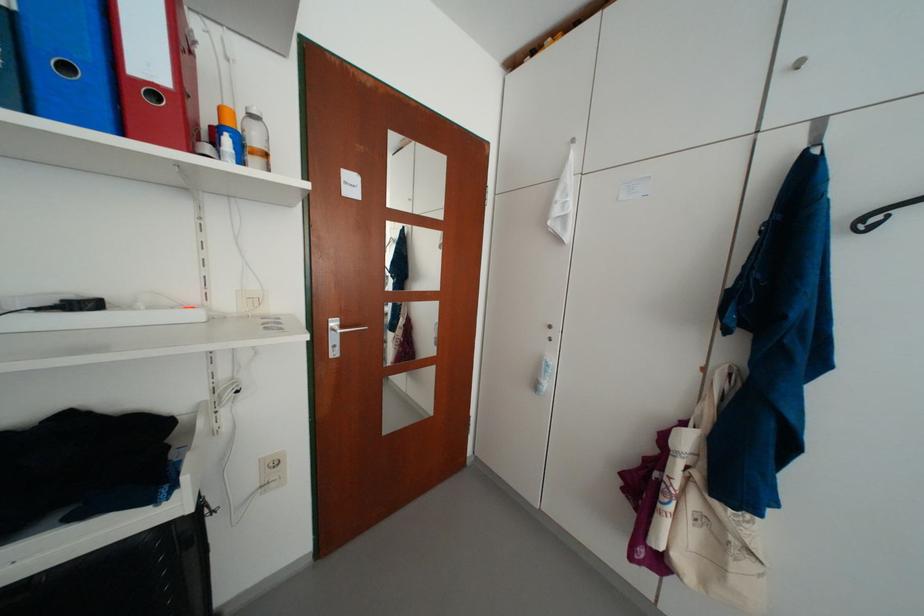
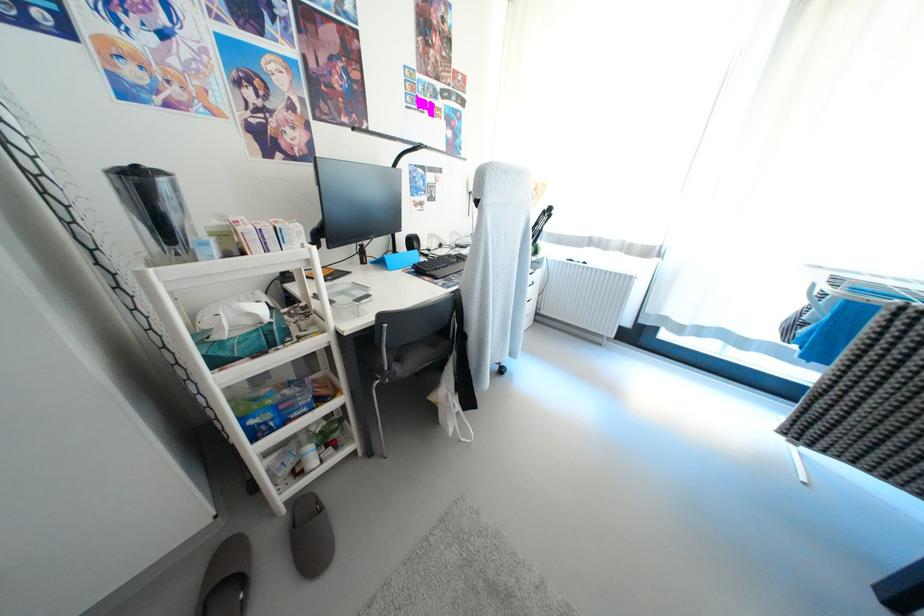
How did the camera likely rotate?

The rotation direction of the camera is right-down.